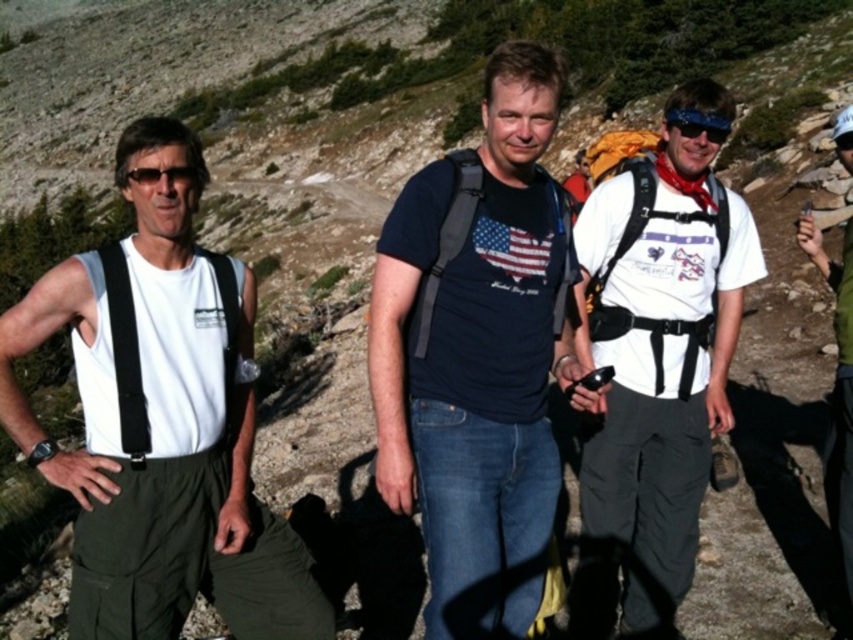
Consider the image. Between white matte tank top at left and blue reflective lens sunglasses at upper right, which one has less height?

Standing shorter between the two is blue reflective lens sunglasses at upper right.

Does white matte tank top at left have a lesser height compared to blue reflective lens sunglasses at upper right?

In fact, white matte tank top at left may be taller than blue reflective lens sunglasses at upper right.

This screenshot has height=640, width=853. In order to click on white matte tank top at left in this screenshot , I will do `click(161, 419)`.

Does black fabric suspenders at right have a greater width compared to matte black backpack at center?

No, black fabric suspenders at right is not wider than matte black backpack at center.

The image size is (853, 640). What do you see at coordinates (630, 250) in the screenshot?
I see `black fabric suspenders at right` at bounding box center [630, 250].

Identify the location of black fabric suspenders at right. Image resolution: width=853 pixels, height=640 pixels. (630, 250).

Between matte black backpack at center and black fabric suspenders at left, which one is positioned higher?

Positioned higher is matte black backpack at center.

At what (x,y) coordinates should I click in order to perform the action: click on matte black backpack at center. Please return your answer as a coordinate pair (x, y). The width and height of the screenshot is (853, 640). Looking at the image, I should click on (836, 387).